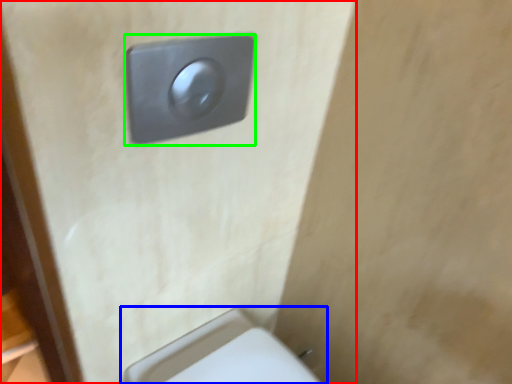
Question: Estimate the real-world distances between objects in this image. Which object is closer to door (highlighted by a red box), toilet (highlighted by a blue box) or light switch (highlighted by a green box)?

Choices:
 (A) toilet
 (B) light switch

Answer: (B)